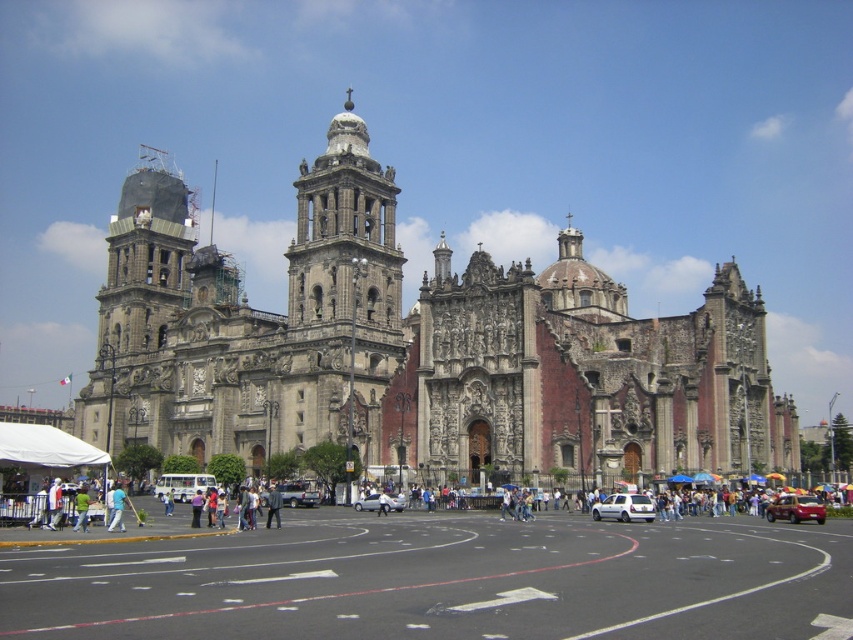
Question: Is gray stone church at center to the left of green fabric bag at center from the viewer's perspective?

Choices:
 (A) no
 (B) yes

Answer: (A)

Question: Which of the following is the closest to the observer?

Choices:
 (A) (192, 477)
 (B) (76, 502)
 (C) (279, 516)
 (D) (776, 508)

Answer: (B)

Question: Among these objects, which one is farthest from the camera?

Choices:
 (A) white matte bus at center
 (B) white matte person at center

Answer: (A)

Question: Based on their relative distances, which object is nearer to the purple fabric at center?

Choices:
 (A) metallic red car at center
 (B) white matte person at center

Answer: (B)

Question: Observing the image, what is the correct spatial positioning of white matte bus at center in reference to dark blue suit at center?

Choices:
 (A) above
 (B) below

Answer: (B)

Question: Can you confirm if metallic red car at center is thinner than green fabric bag at center?

Choices:
 (A) no
 (B) yes

Answer: (B)